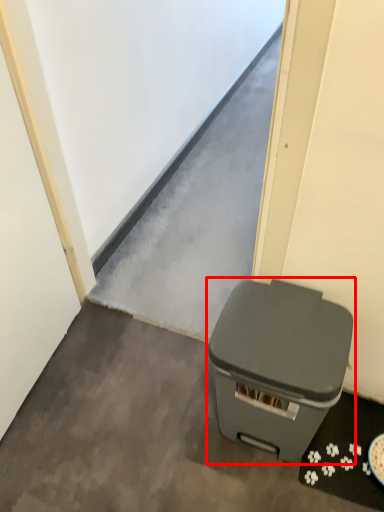
Question: From the image's perspective, considering the relative positions of waste container (annotated by the red box) and concrete in the image provided, where is waste container (annotated by the red box) located with respect to the staircase?

Choices:
 (A) above
 (B) below

Answer: (A)